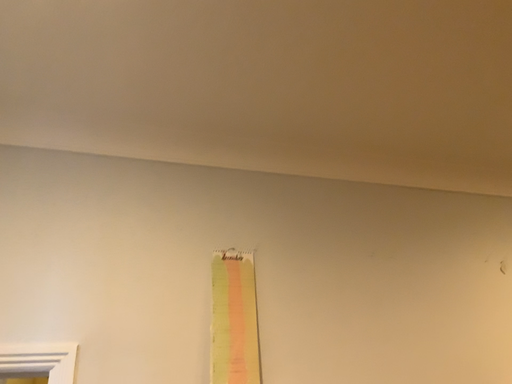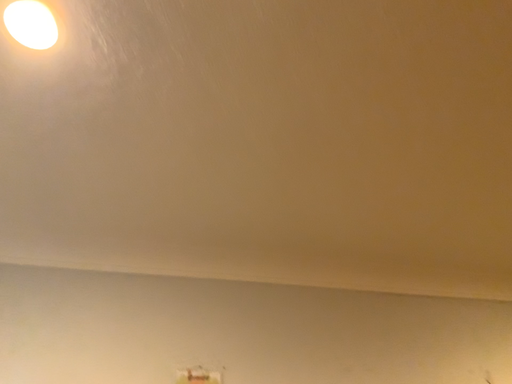
Question: How did the camera likely rotate when shooting the video?

Choices:
 (A) rotated upward
 (B) rotated downward

Answer: (A)